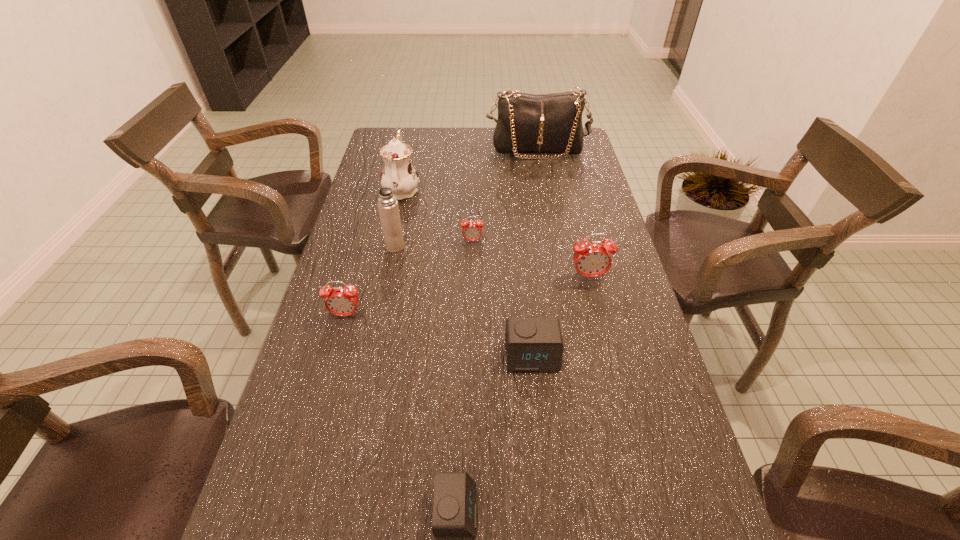
The width and height of the screenshot is (960, 540). Find the location of `free space between the seventh farthest object and the fifth shortest object`. free space between the seventh farthest object and the fifth shortest object is located at coordinates (561, 316).

Identify the location of vacant area that lies between the farthest red alarm clock and the fourth farthest alarm clock. (502, 298).

Where is `vacant space in between the nearer black alarm clock and the farthest red alarm clock`? vacant space in between the nearer black alarm clock and the farthest red alarm clock is located at coordinates (465, 376).

Locate an element on the screen. This screenshot has height=540, width=960. object that is the sixth closest to the nearer black alarm clock is located at coordinates (398, 174).

You are a GUI agent. You are given a task and a screenshot of the screen. Output one action in this format:
    pyautogui.click(x=<x>, y=<y>)
    Task: Click on the object that is the fourth closest one to the right black alarm clock
    The image size is (960, 540).
    Given the screenshot: What is the action you would take?
    pyautogui.click(x=339, y=301)

Locate an element on the screen. alarm clock that is the second closest to the seventh nearest object is located at coordinates (339, 301).

Where is `alarm clock that stands as the third closest to the farthest alarm clock`? Image resolution: width=960 pixels, height=540 pixels. alarm clock that stands as the third closest to the farthest alarm clock is located at coordinates [532, 344].

Where is `red alarm clock that can be found as the third closest to the farthest object`? This screenshot has width=960, height=540. red alarm clock that can be found as the third closest to the farthest object is located at coordinates (339, 301).

What are the coordinates of `red alarm clock that is the closest to the farthest red alarm clock` in the screenshot? It's located at (593, 259).

This screenshot has height=540, width=960. What are the coordinates of `free space in the image that satisfies the following two spatial constraints: 1. at the front of the tallest object with chain and zipper; 2. on the front-facing side of the shortest alarm clock` in the screenshot? It's located at (601, 510).